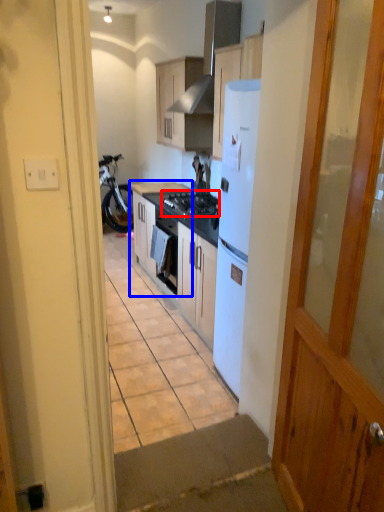
Question: Which object appears closest to the camera in this image, gas stove (highlighted by a red box) or cabinetry (highlighted by a blue box)?

Choices:
 (A) gas stove
 (B) cabinetry

Answer: (A)